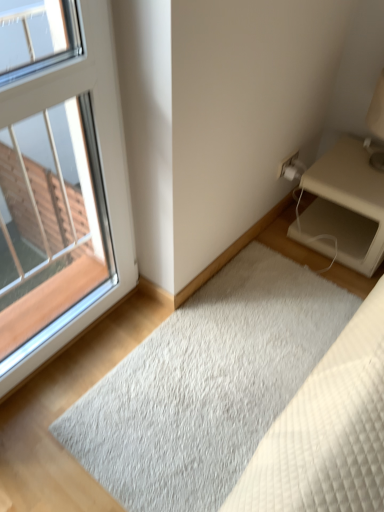
Question: Is beige matte nightstand at right not close to white plastic window at upper left?

Choices:
 (A) no
 (B) yes

Answer: (A)

Question: Does beige matte nightstand at right have a lesser width compared to white plastic window at upper left?

Choices:
 (A) yes
 (B) no

Answer: (B)

Question: Does beige matte nightstand at right appear on the right side of white plastic window at upper left?

Choices:
 (A) yes
 (B) no

Answer: (A)

Question: Is beige matte nightstand at right looking in the opposite direction of white plastic window at upper left?

Choices:
 (A) yes
 (B) no

Answer: (B)

Question: Is beige matte nightstand at right to the left of white plastic window at upper left from the viewer's perspective?

Choices:
 (A) yes
 (B) no

Answer: (B)

Question: From a real-world perspective, is beige matte nightstand at right physically below white plastic window at upper left?

Choices:
 (A) no
 (B) yes

Answer: (B)

Question: Considering the relative sizes of white plastic window at upper left and white shaggy rug at lower center in the image provided, is white plastic window at upper left thinner than white shaggy rug at lower center?

Choices:
 (A) yes
 (B) no

Answer: (A)

Question: From the image's perspective, would you say white plastic window at upper left is positioned over white shaggy rug at lower center?

Choices:
 (A) yes
 (B) no

Answer: (A)

Question: Is white plastic window at upper left at the right side of white shaggy rug at lower center?

Choices:
 (A) no
 (B) yes

Answer: (A)

Question: Considering the relative sizes of white plastic window at upper left and white shaggy rug at lower center in the image provided, is white plastic window at upper left wider than white shaggy rug at lower center?

Choices:
 (A) yes
 (B) no

Answer: (B)

Question: From a real-world perspective, is white plastic window at upper left located higher than white shaggy rug at lower center?

Choices:
 (A) yes
 (B) no

Answer: (A)

Question: Would you say white plastic window at upper left is a long distance from white shaggy rug at lower center?

Choices:
 (A) yes
 (B) no

Answer: (B)

Question: From the image's perspective, would you say white plastic window at upper left is positioned over beige matte nightstand at right?

Choices:
 (A) no
 (B) yes

Answer: (A)